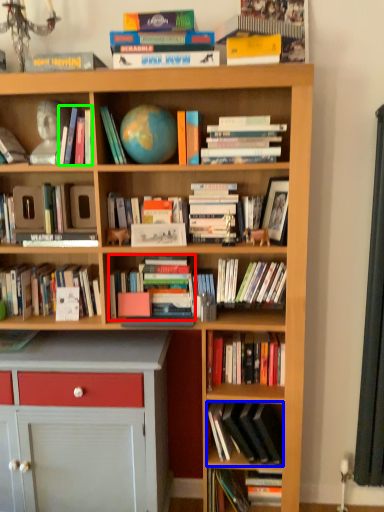
Question: Which is nearer to the book (highlighted by a red box)? book (highlighted by a blue box) or book (highlighted by a green box).

Choices:
 (A) book
 (B) book

Answer: (A)